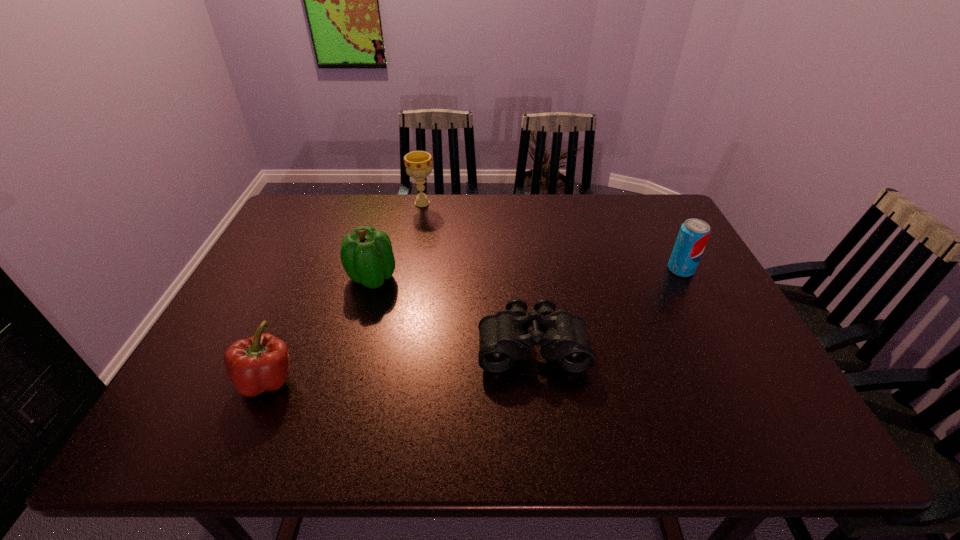
Locate an element on the screen. chalice is located at coordinates (418, 164).

Image resolution: width=960 pixels, height=540 pixels. I want to click on the right bell pepper, so click(x=366, y=255).

I want to click on the farther bell pepper, so click(366, 255).

Locate an element on the screen. This screenshot has height=540, width=960. the rightmost object is located at coordinates (694, 233).

Locate an element on the screen. This screenshot has height=540, width=960. the fourth tallest object is located at coordinates (261, 363).

Image resolution: width=960 pixels, height=540 pixels. I want to click on the shorter bell pepper, so click(x=261, y=363).

What are the coordinates of `binoculars` in the screenshot? It's located at (503, 337).

In order to click on the shortest object in this screenshot , I will do `click(503, 337)`.

Locate an element on the screen. free space located on the right of the farthest object is located at coordinates (486, 203).

Locate an element on the screen. free space located 0.250m on the left of the right bell pepper is located at coordinates (256, 278).